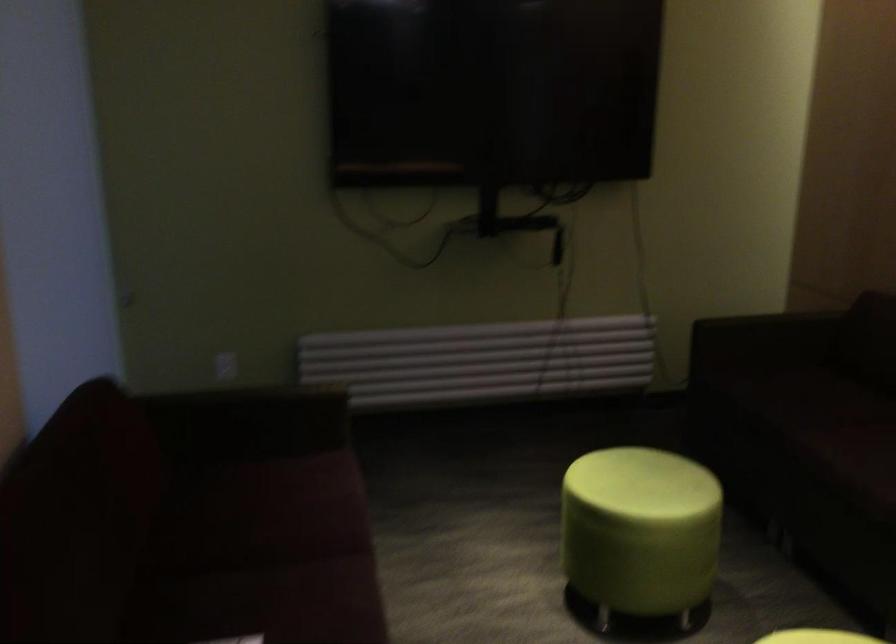
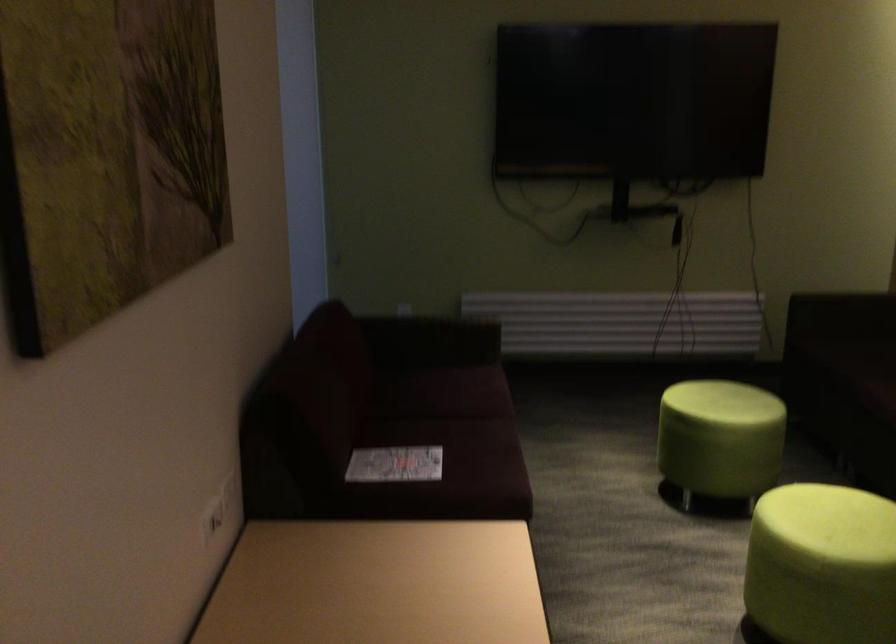
In the second image, find the point that corresponds to point (238, 467) in the first image.

(426, 371)